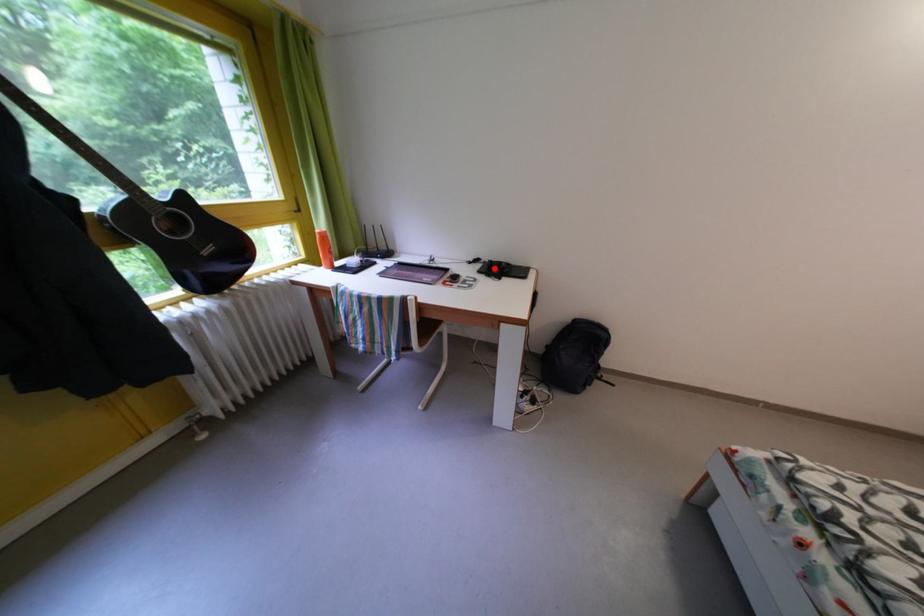
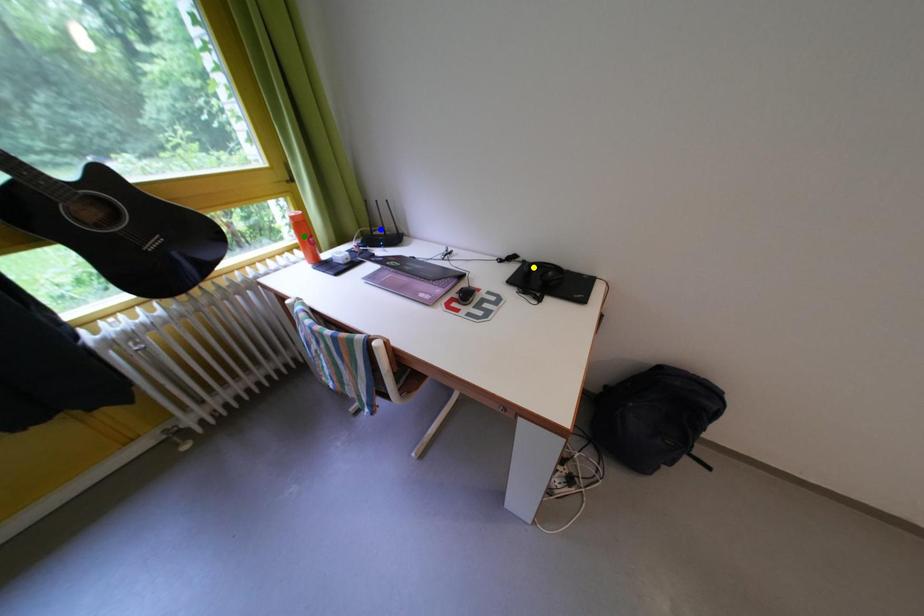
Question: I am providing you with two images of the same scene from different viewpoints. A red point is marked on the first image. You are given multiple points on the second image. Which spot in image 2 lines up with the point in image 1?

Choices:
 (A) green point
 (B) yellow point
 (C) blue point

Answer: (B)